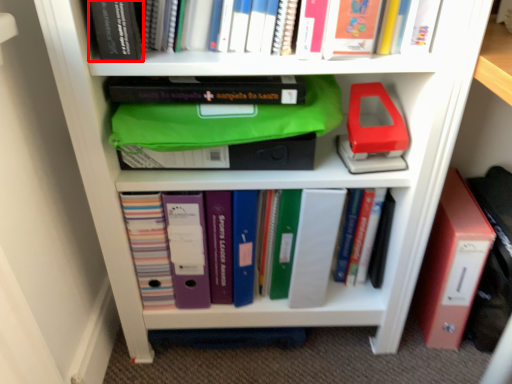
Question: From the image's perspective, what is the correct spatial positioning of book (annotated by the red box) in reference to book?

Choices:
 (A) below
 (B) above

Answer: (B)